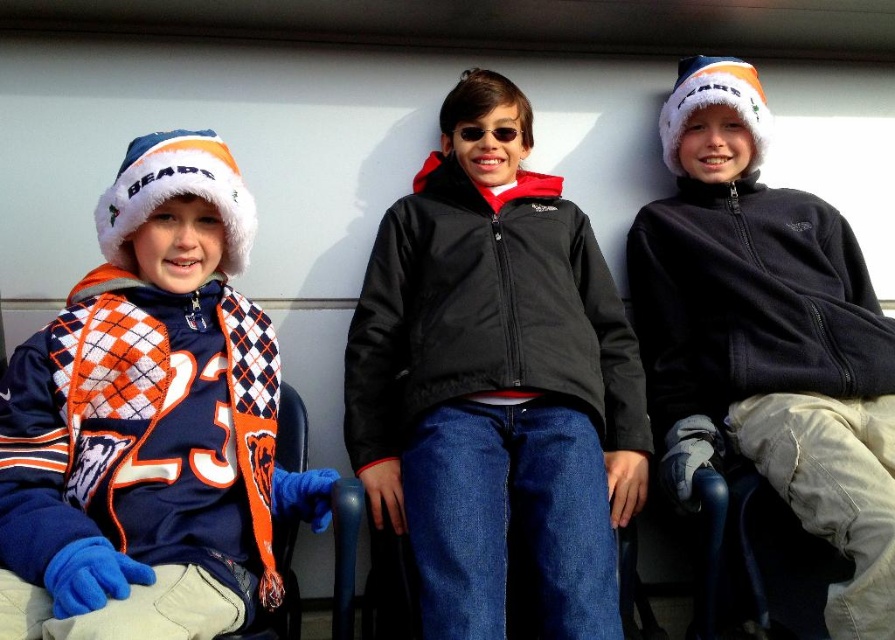
Is black softshell jacket at center thinner than dark blue fleece jacket at center?

In fact, black softshell jacket at center might be wider than dark blue fleece jacket at center.

Who is higher up, black softshell jacket at center or dark blue fleece jacket at center?

dark blue fleece jacket at center is higher up.

Which is behind, point (484, 292) or point (740, 291)?

The point (740, 291) is behind.

Where is `black softshell jacket at center`? This screenshot has height=640, width=895. black softshell jacket at center is located at coordinates (496, 381).

Is point (437, 401) closer to viewer compared to point (107, 321)?

No, (437, 401) is further to viewer.

The image size is (895, 640). Describe the element at coordinates (496, 381) in the screenshot. I see `black softshell jacket at center` at that location.

Between point (547, 364) and point (114, 556), which one is positioned behind?

The point (547, 364) is behind.

Identify the location of black softshell jacket at center. (496, 381).

Does argyle knit scarf at left have a lesser height compared to dark blue fleece jacket at center?

Yes.

Between point (134, 460) and point (871, 525), which one is positioned behind?

Point (134, 460)

This screenshot has height=640, width=895. Identify the location of argyle knit scarf at left. (149, 420).